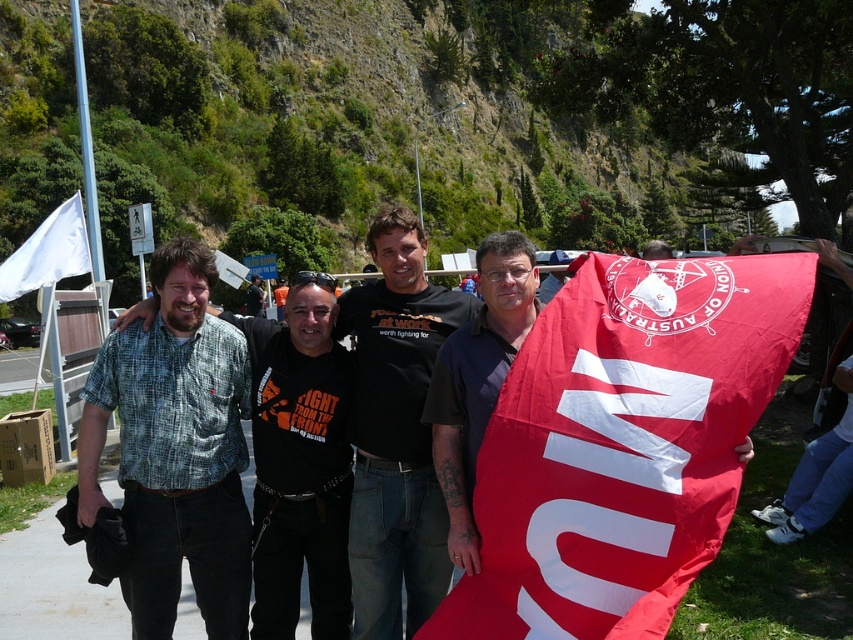
Which is behind, point (387, 602) or point (45, 243)?

Point (45, 243)

What are the coordinates of `black cotton t-shirt at center` in the screenshot? It's located at (395, 429).

Based on the photo, does red fabric flag at right come behind dark blue shirt at center?

No, red fabric flag at right is in front of dark blue shirt at center.

Can you confirm if red fabric flag at right is positioned above dark blue shirt at center?

No.

Does point (579, 442) come closer to viewer compared to point (483, 310)?

Yes, it is in front of point (483, 310).

Where is `red fabric flag at right`? This screenshot has height=640, width=853. red fabric flag at right is located at coordinates (622, 444).

Between green plaid shirt at left and dark blue shirt at center, which one is positioned higher?

Positioned higher is dark blue shirt at center.

Which is below, green plaid shirt at left or dark blue shirt at center?

green plaid shirt at left

In order to click on green plaid shirt at left in this screenshot , I will do `click(175, 449)`.